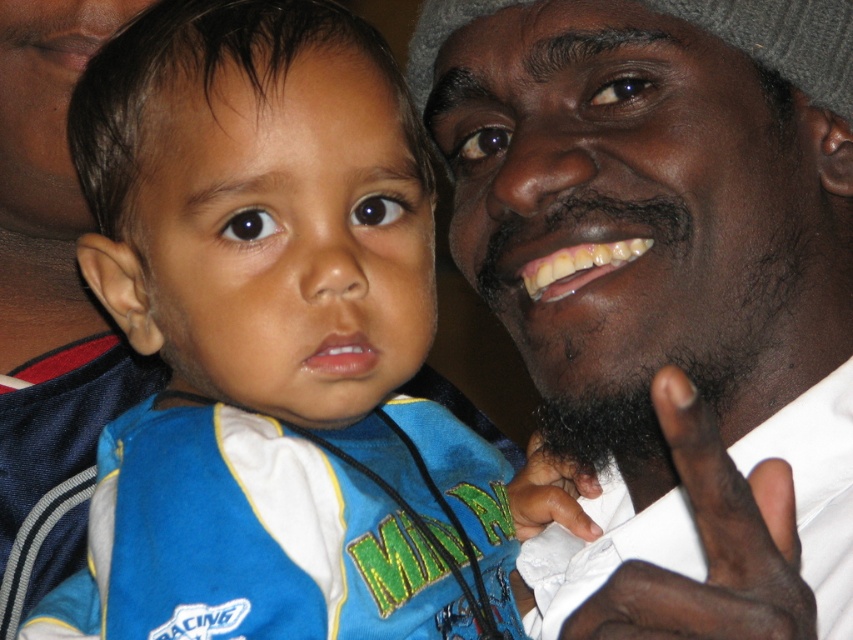
Question: Can you confirm if smooth skin face at upper right is wider than black fuzzy beard at right?

Choices:
 (A) no
 (B) yes

Answer: (B)

Question: Considering the relative positions of black fuzzy beard at right and dark skin textured hand at lower right in the image provided, where is black fuzzy beard at right located with respect to dark skin textured hand at lower right?

Choices:
 (A) right
 (B) left

Answer: (A)

Question: Which object is farther from the camera taking this photo?

Choices:
 (A) blue fabric shirt at center
 (B) smooth skin face at upper right
 (C) dark skin textured hand at lower right
 (D) black fuzzy beard at right

Answer: (D)

Question: Which is nearer to the blue fabric shirt at center?

Choices:
 (A) dark skin textured hand at lower right
 (B) black fuzzy beard at right
 (C) dark skin hand at lower center
 (D) smooth skin face at upper right

Answer: (D)

Question: Can you confirm if blue fabric shirt at center is smaller than dark skin textured hand at lower right?

Choices:
 (A) yes
 (B) no

Answer: (B)

Question: Considering the real-world distances, which object is farthest from the dark skin textured hand at lower right?

Choices:
 (A) blue fabric shirt at center
 (B) dark skin hand at lower center
 (C) smooth skin face at upper right
 (D) black fuzzy beard at right

Answer: (B)